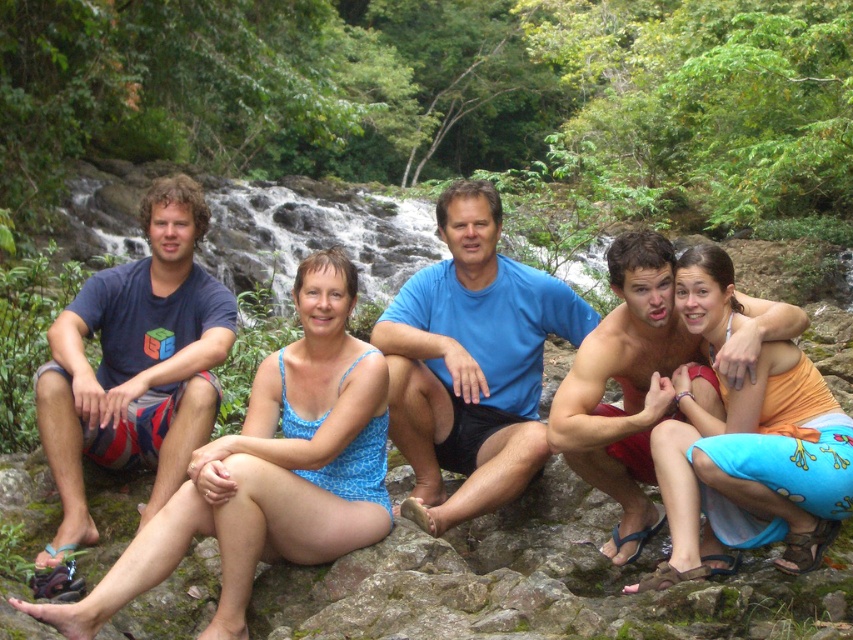
What are the coordinates of the blue printed swimsuit at center?

The coordinates of the blue printed swimsuit at center are at point (271,468).